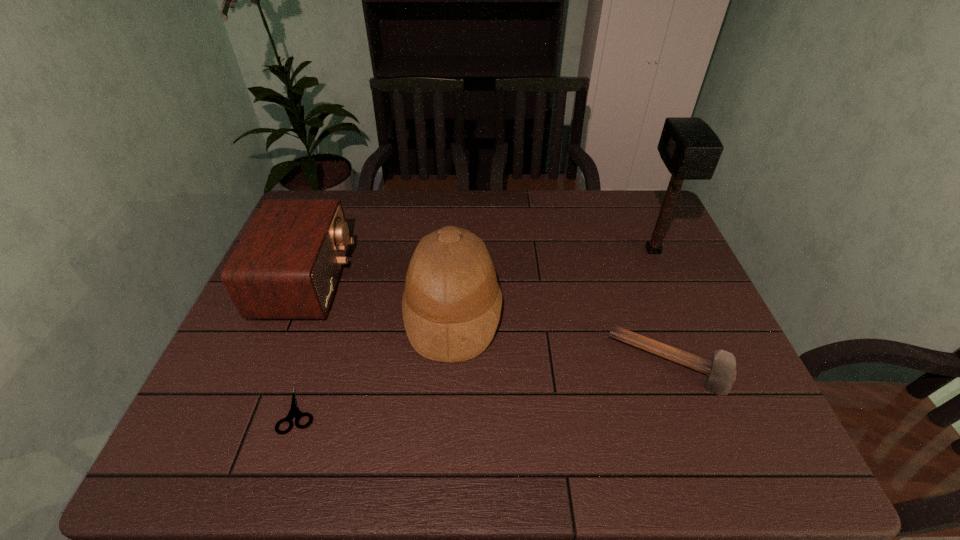
You are a GUI agent. You are given a task and a screenshot of the screen. Output one action in this format:
    pyautogui.click(x=<x>, y=<y>)
    Task: Click on the free location that satisfies the following two spatial constraints: 1. on the front panel of the third tallest object; 2. on the right side of the second shortest object
    The height and width of the screenshot is (540, 960).
    Given the screenshot: What is the action you would take?
    pyautogui.click(x=274, y=363)

Find the location of a particular element. vacant position in the image that satisfies the following two spatial constraints: 1. on the back side of the second shortest object; 2. on the front panel of the radio receiver is located at coordinates (640, 281).

At what (x,y) coordinates should I click in order to perform the action: click on free space that satisfies the following two spatial constraints: 1. on the front panel of the third shortest object; 2. on the left side of the shears. Please return your answer as a coordinate pair (x, y). Image resolution: width=960 pixels, height=540 pixels. Looking at the image, I should click on (254, 410).

The width and height of the screenshot is (960, 540). Identify the location of free space that satisfies the following two spatial constraints: 1. on the front panel of the third tallest object; 2. on the back side of the second shortest object. (274, 363).

You are a GUI agent. You are given a task and a screenshot of the screen. Output one action in this format:
    pyautogui.click(x=<x>, y=<y>)
    Task: Click on the free space that satisfies the following two spatial constraints: 1. on the front panel of the radio receiver; 2. on the right side of the shears
    The height and width of the screenshot is (540, 960).
    Given the screenshot: What is the action you would take?
    pyautogui.click(x=254, y=410)

The width and height of the screenshot is (960, 540). I want to click on free region that satisfies the following two spatial constraints: 1. on the front-facing side of the hat; 2. on the back side of the nearer mallet, so click(x=450, y=363).

Locate an element on the screen. vacant area in the image that satisfies the following two spatial constraints: 1. on the back side of the shortest object; 2. on the front panel of the third tallest object is located at coordinates (341, 281).

Where is `free location that satisfies the following two spatial constraints: 1. on the back side of the taller mallet; 2. on the right side of the shears`? free location that satisfies the following two spatial constraints: 1. on the back side of the taller mallet; 2. on the right side of the shears is located at coordinates (351, 251).